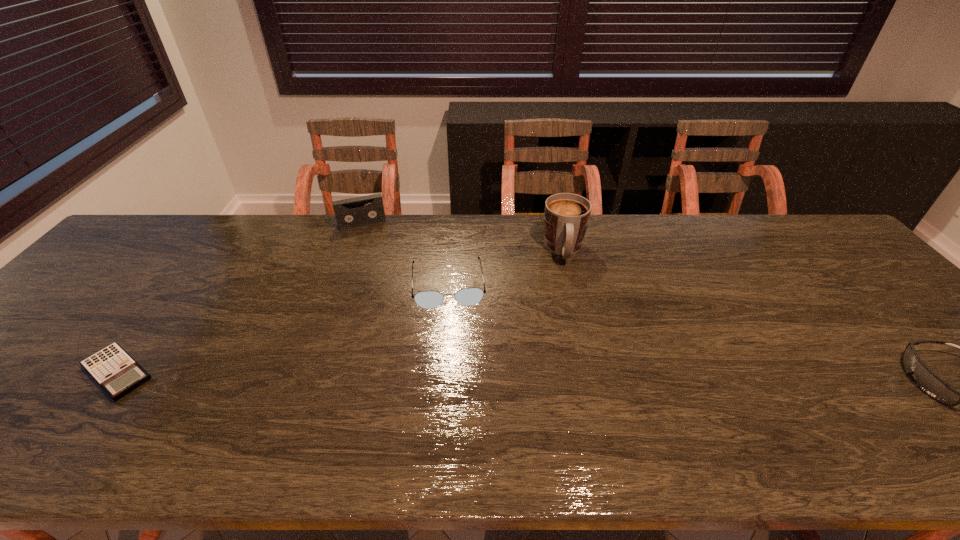
I want to click on empty space that is in between the farthest object and the leftmost object, so click(x=240, y=298).

What are the coordinates of `empty location between the tallest object and the calculator` in the screenshot? It's located at pyautogui.click(x=341, y=312).

Locate an element on the screen. Image resolution: width=960 pixels, height=540 pixels. object that is the fourth closest to the leftmost object is located at coordinates (928, 381).

Identify the location of the second closest object relative to the rightmost object. Image resolution: width=960 pixels, height=540 pixels. (468, 296).

At what (x,y) coordinates should I click in order to perform the action: click on free space that satisfies the following two spatial constraints: 1. on the back side of the leftmost object; 2. on the right side of the second object from left to right. Please return your answer as a coordinate pair (x, y). Looking at the image, I should click on (230, 224).